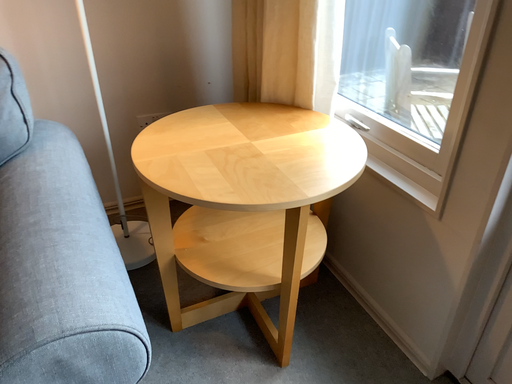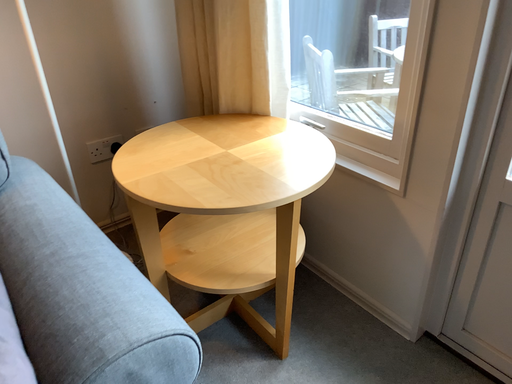
Question: How did the camera likely rotate when shooting the video?

Choices:
 (A) rotated right
 (B) rotated left

Answer: (A)